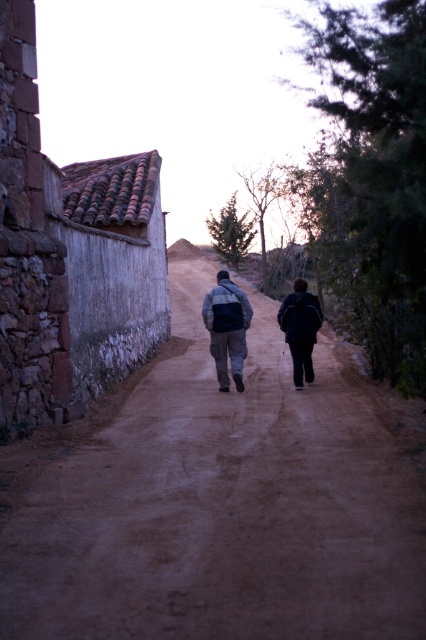
This screenshot has height=640, width=426. What do you see at coordinates (222, 508) in the screenshot?
I see `dusty dirt road at center` at bounding box center [222, 508].

Does point (89, 458) lie in front of point (236, 372)?

Yes, point (89, 458) is closer to viewer.

Which is behind, point (63, 534) or point (241, 342)?

Positioned behind is point (241, 342).

This screenshot has height=640, width=426. Identify the location of dusty dirt road at center. (222, 508).

Between point (222, 276) and point (230, 305), which one is positioned behind?

Positioned behind is point (222, 276).

Is dark blue backpack at center wider than matte gray jacket at center?

Correct, the width of dark blue backpack at center exceeds that of matte gray jacket at center.

This screenshot has width=426, height=640. Describe the element at coordinates (227, 328) in the screenshot. I see `dark blue backpack at center` at that location.

I want to click on dark blue backpack at center, so click(x=227, y=328).

Is point (414, 636) positioned before point (144, 269)?

Yes, point (414, 636) is closer to viewer.

The width and height of the screenshot is (426, 640). I want to click on dusty dirt road at center, so click(222, 508).